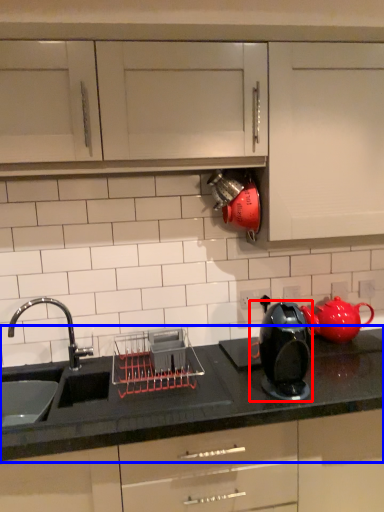
Question: Among these objects, which one is farthest to the camera, home appliance (highlighted by a red box) or countertop (highlighted by a blue box)?

Choices:
 (A) home appliance
 (B) countertop

Answer: (A)